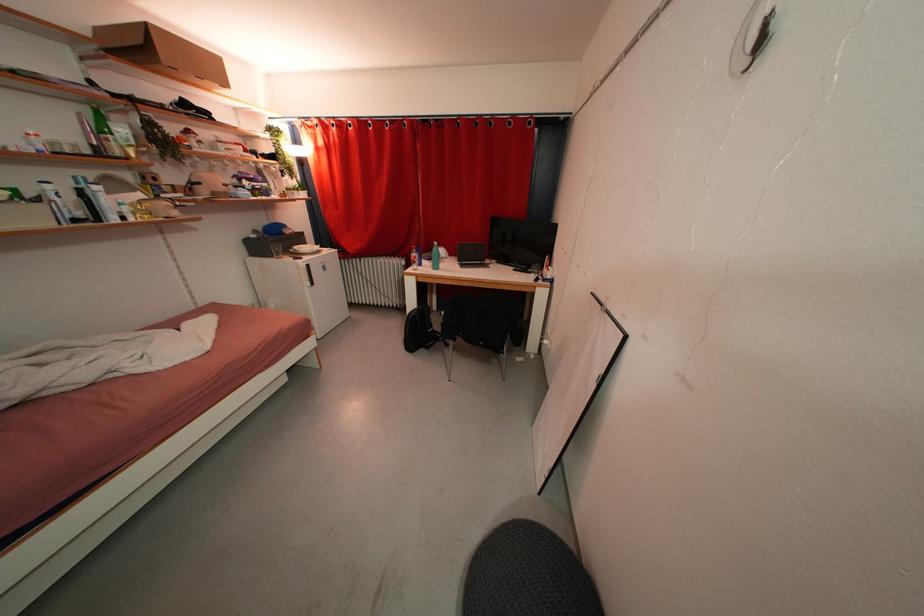
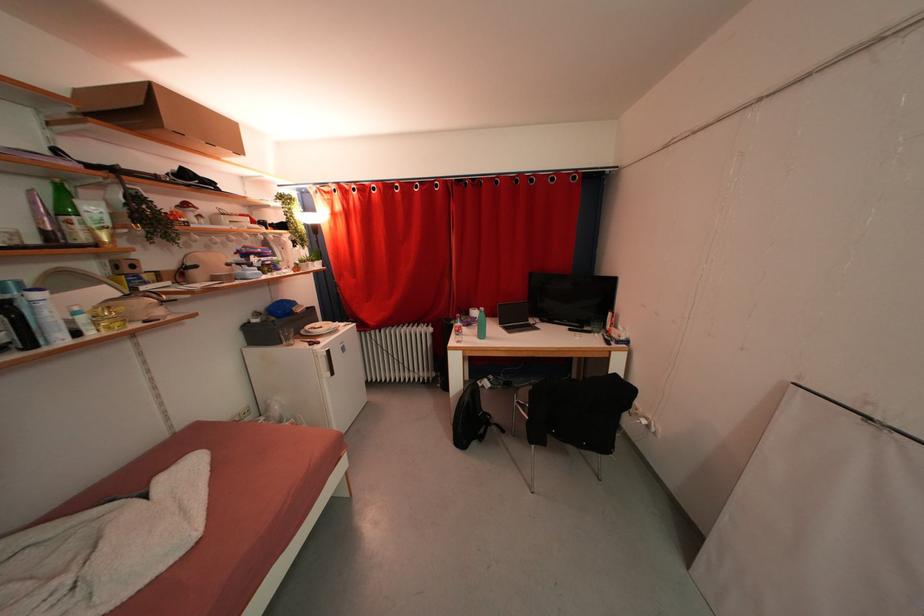
Where in the second image is the point corresponding to [419,317] from the first image?

(472, 403)